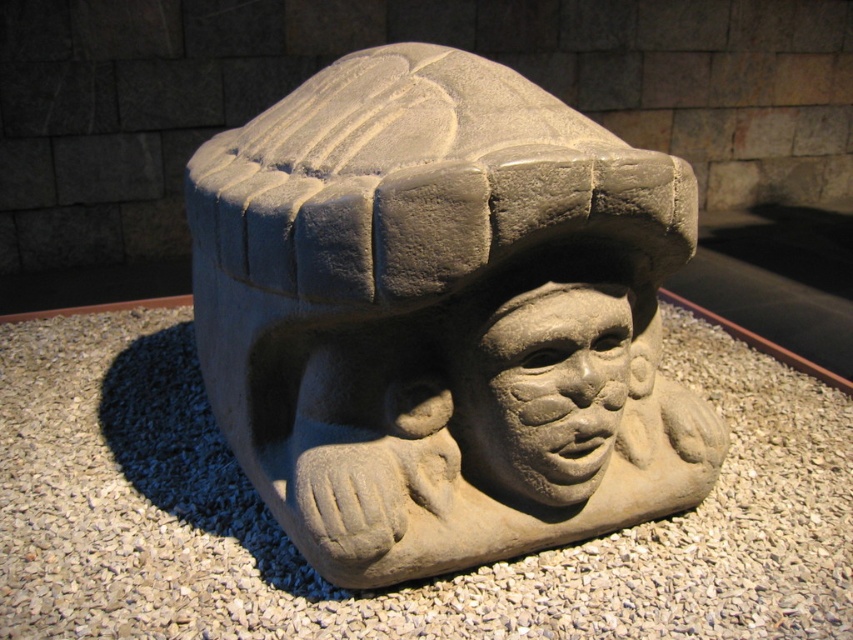
You are an art conservator examining a stone sculpture in a museum. The sculpture is located at point [442,316]. You need to determine the best position to place a protective barrier around it. Considering the sculpture is at the center, where would you position the barrier to ensure it is equidistant from all sides?

Since the gray stone carving at center is represented by point [442,316], placing the protective barrier around this central point ensures it is equidistant from all sides.

You are an art restorer examining the sculpture. You need to determine which part of the sculpture is taller for proper restoration planning. Which is taller between the gray stone carving at center and the gray stone face at center?

The gray stone carving at center is taller than the gray stone face at center according to the description.